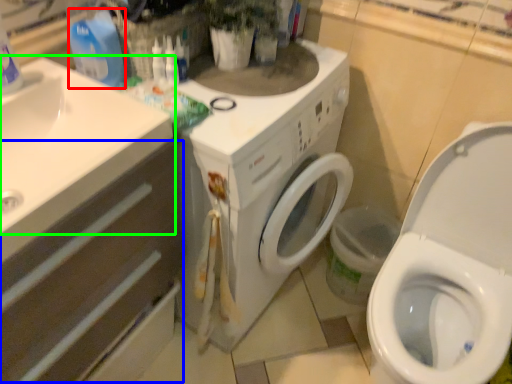
Question: Which object is positioned farthest from cleaning product (highlighted by a red box)? Select from drawer (highlighted by a blue box) and sink (highlighted by a green box).

Choices:
 (A) drawer
 (B) sink

Answer: (A)